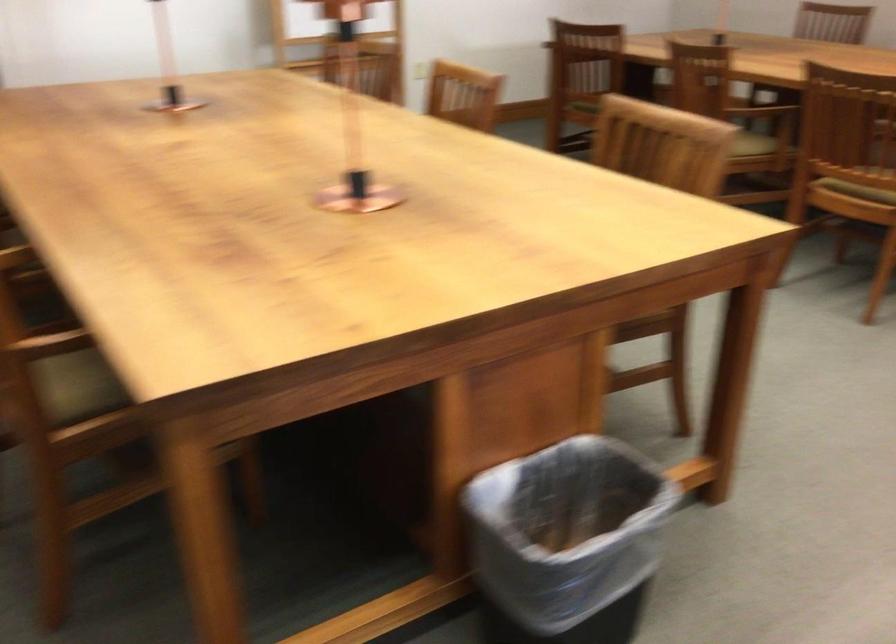
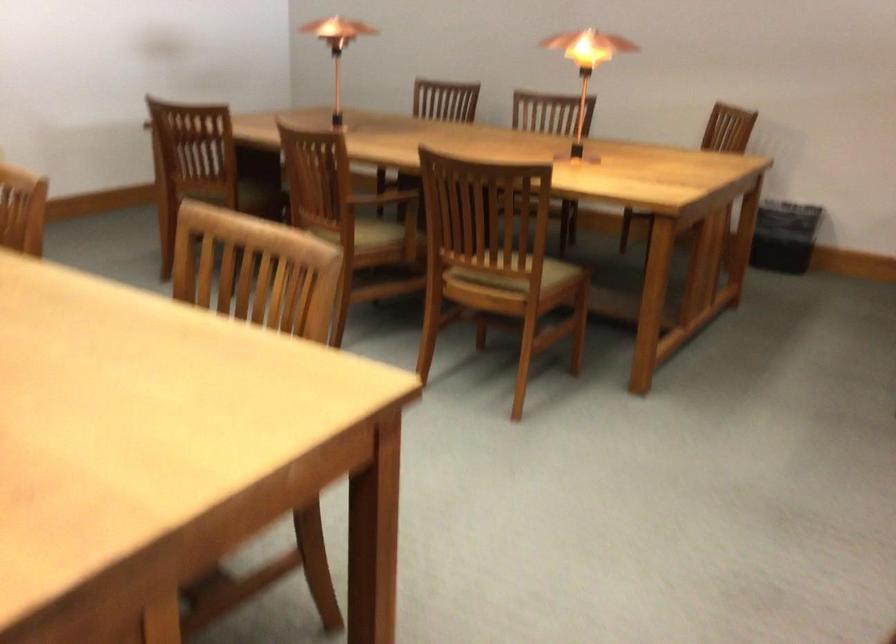
Question: The camera is either moving clockwise (left) or counter-clockwise (right) around the object. The first image is from the beginning of the video and the second image is from the end. Is the camera moving left or right when shooting the video?

Choices:
 (A) Left
 (B) Right

Answer: (A)